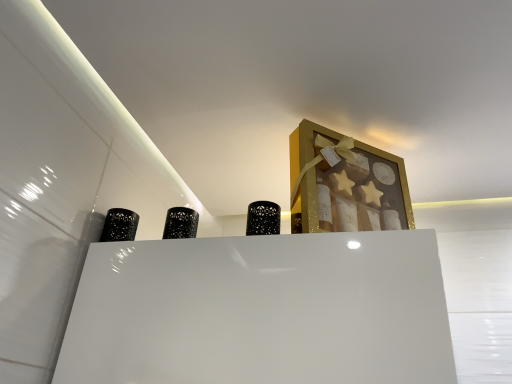
Question: Should I look upward or downward to see gold glitter picture frame at upper center?

Choices:
 (A) down
 (B) up

Answer: (B)